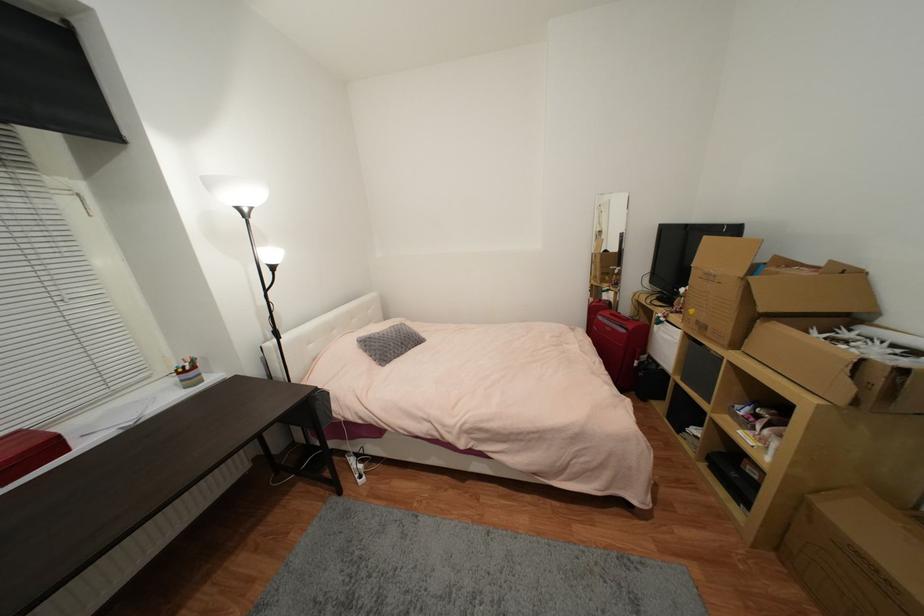
The height and width of the screenshot is (616, 924). Describe the element at coordinates (277, 334) in the screenshot. I see `a lamp rotary switch` at that location.